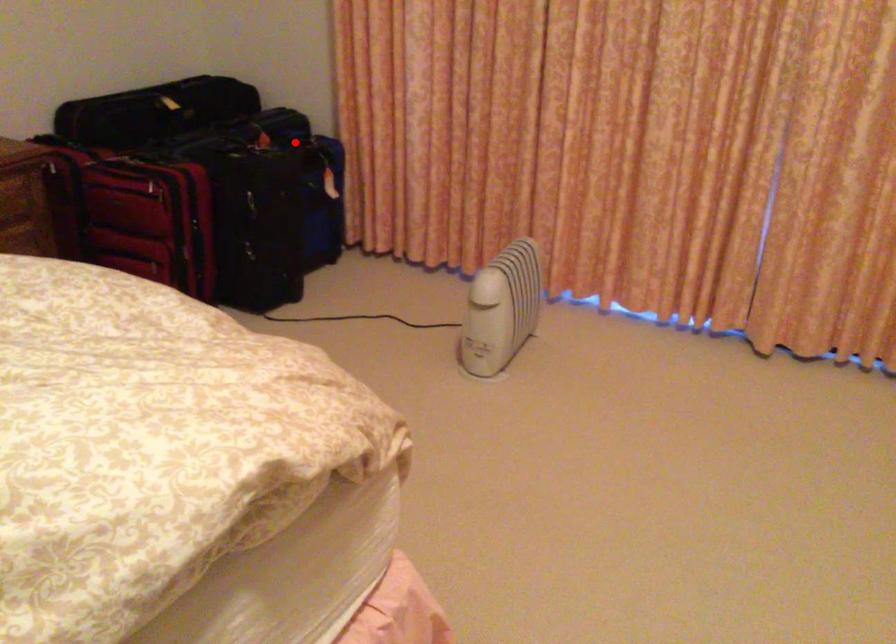
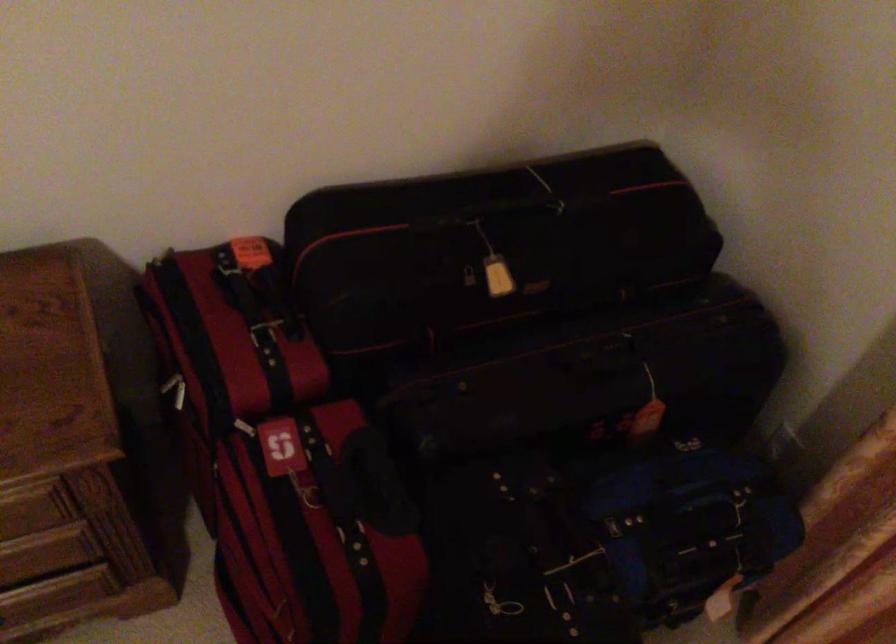
Question: I am providing you with two images of the same scene from different viewpoints. Image1 has a red point marked. In image2, the corresponding 3D location appears at what relative position? Reply with the corresponding letter.

Choices:
 (A) Closer
 (B) Farther

Answer: (A)